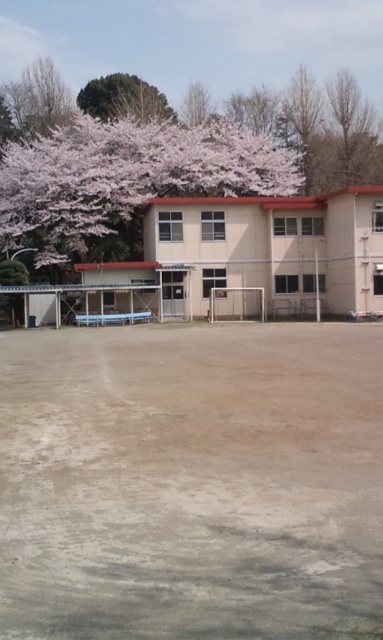
Can you confirm if pink blossoms at upper left is bigger than green leafy tree at upper center?

No.

Is pink blossoms at upper left wider than green leafy tree at upper center?

Correct, the width of pink blossoms at upper left exceeds that of green leafy tree at upper center.

The image size is (383, 640). I want to click on pink blossoms at upper left, so point(126,177).

Can you confirm if brown sandy dirt field at center is shorter than pink blossoms at upper left?

Correct, brown sandy dirt field at center is not as tall as pink blossoms at upper left.

Is brown sandy dirt field at center below pink blossoms at upper left?

Correct, brown sandy dirt field at center is located below pink blossoms at upper left.

Between point (276, 410) and point (50, 196), which one is positioned behind?

The point (50, 196) is more distant.

At what (x,y) coordinates should I click in order to perform the action: click on brown sandy dirt field at center. Please return your answer as a coordinate pair (x, y). Looking at the image, I should click on (191, 481).

Identify the location of brown sandy dirt field at center. The image size is (383, 640). (191, 481).

Which is more to the left, brown sandy dirt field at center or green leafy tree at upper center?

Positioned to the left is green leafy tree at upper center.

Describe the element at coordinates (191, 481) in the screenshot. I see `brown sandy dirt field at center` at that location.

The image size is (383, 640). What are the coordinates of `brown sandy dirt field at center` in the screenshot? It's located at (191, 481).